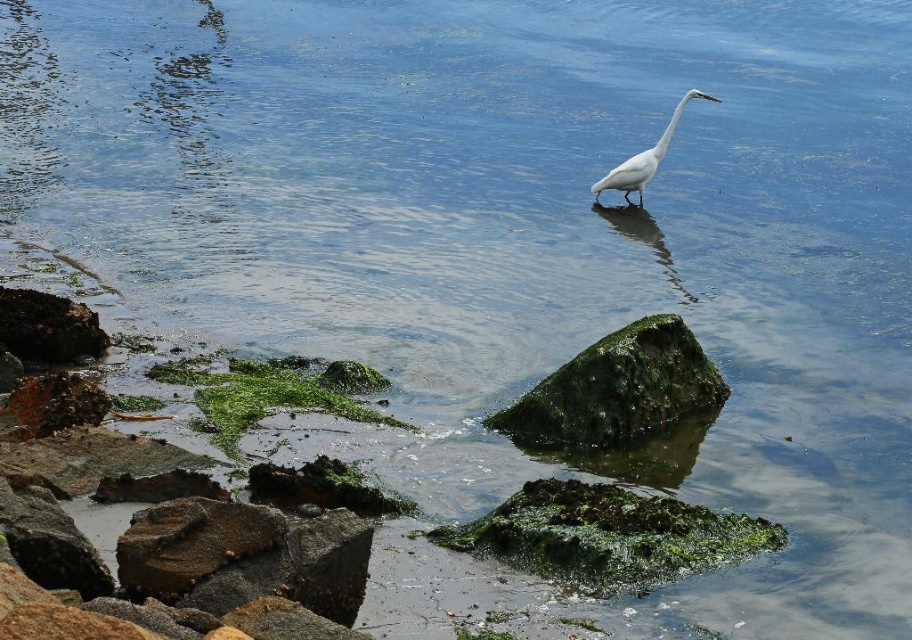
You are a photographer aiming to capture the white smooth bird at center and the green mossy algae at lower left in the same frame. Based on their heights, which object will appear smaller in the photo?

The green mossy algae at lower left will appear smaller in the photo because it has a lesser height compared to the white smooth bird at center.

You are a photographer trying to capture the white smooth bird at center in your shot. You notice the green mossy algae at lower left might be distracting. Can you adjust your camera angle to make the algae smaller than the bird?

The green mossy algae at lower left is bigger than the white smooth bird at center, so adjusting the camera angle to make the algae smaller than the bird would not be possible since the algae is already larger in size.